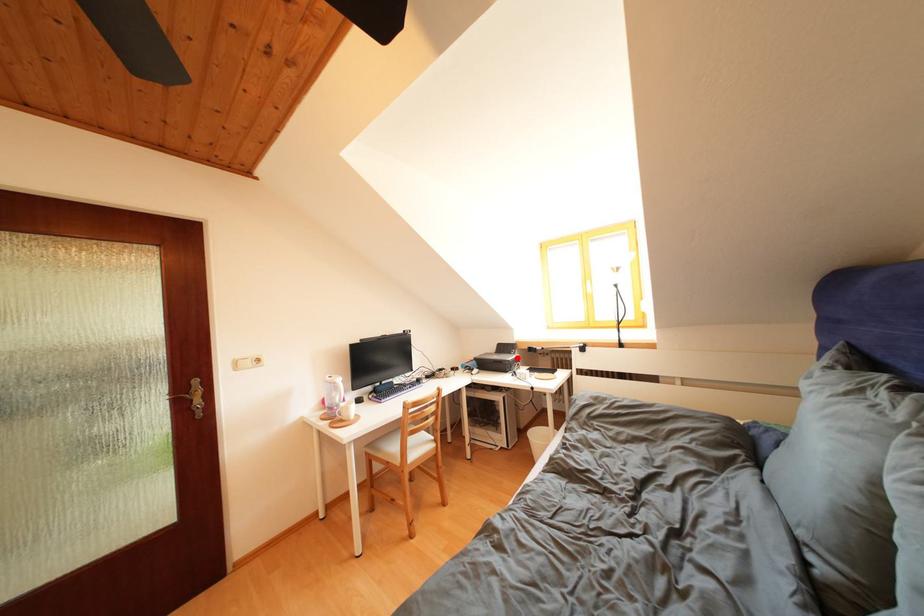
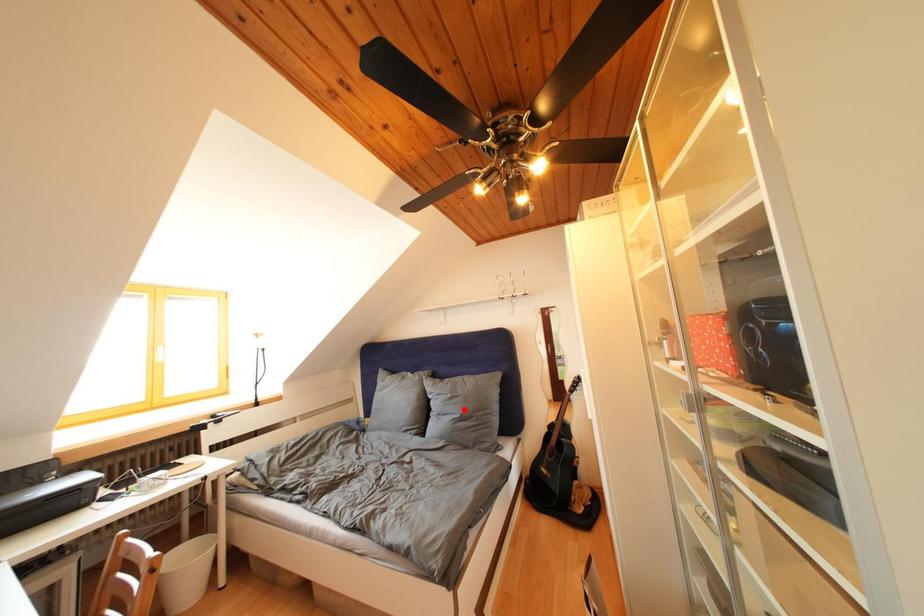
I am providing you with two images of the same scene from different viewpoints. A red point is marked on the first image and another point is marked on the second image. Is the marked point in image1 the same physical position as the marked point in image2?

No